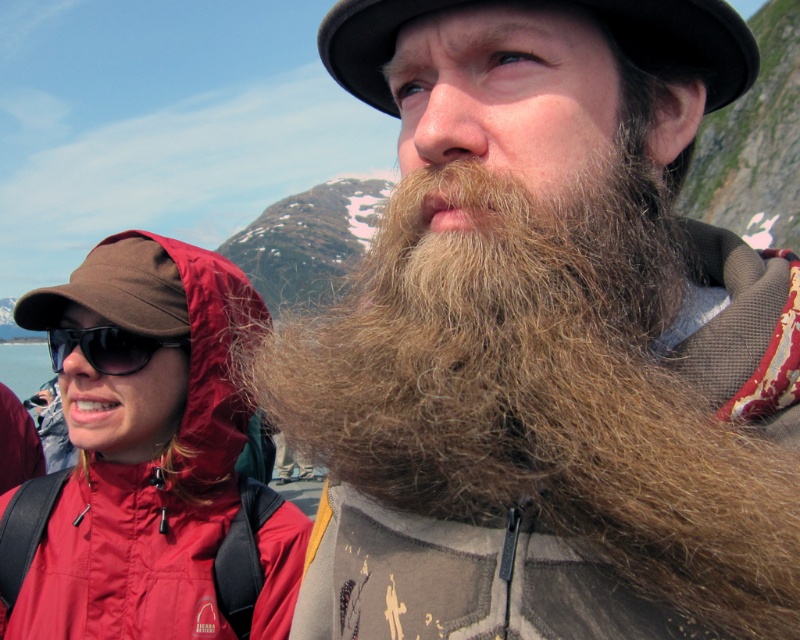
Question: Is brown fuzzy beard at center to the left of black plastic sunglasses at upper left from the viewer's perspective?

Choices:
 (A) yes
 (B) no

Answer: (B)

Question: Which object is the closest to the black plastic sunglasses at upper left?

Choices:
 (A) brown fuzzy beard at center
 (B) matte red jacket at left
 (C) black felt hat at upper center

Answer: (B)

Question: Among these objects, which one is farthest from the camera?

Choices:
 (A) black plastic sunglasses at upper left
 (B) black felt hat at upper center

Answer: (A)

Question: Does brown fuzzy beard at center appear on the left side of black plastic sunglasses at upper left?

Choices:
 (A) no
 (B) yes

Answer: (A)

Question: Which point is farther to the camera?

Choices:
 (A) matte red jacket at left
 (B) brown fuzzy beard at center

Answer: (A)

Question: Is brown fuzzy beard at center positioned behind matte red jacket at left?

Choices:
 (A) yes
 (B) no

Answer: (B)